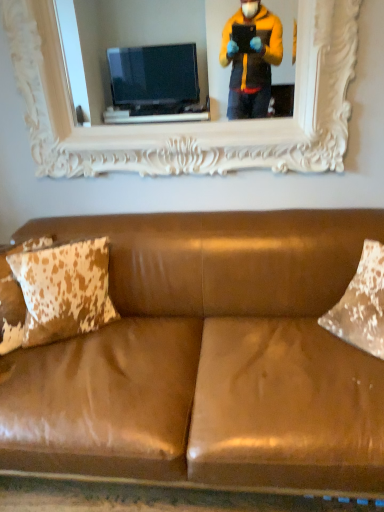
Question: From their relative heights in the image, would you say brown leather couch at center is taller or shorter than brown cowhide pillow at left?

Choices:
 (A) tall
 (B) short

Answer: (A)

Question: Is point (350, 400) closer or farther from the camera than point (77, 251)?

Choices:
 (A) farther
 (B) closer

Answer: (B)

Question: Which object is the closest to the brown cowhide pillow at left?

Choices:
 (A) white carved wood picture frame at upper center
 (B) brown leather couch at center

Answer: (B)

Question: Which of these objects is positioned farthest from the white carved wood picture frame at upper center?

Choices:
 (A) brown leather couch at center
 (B) brown cowhide pillow at left

Answer: (A)